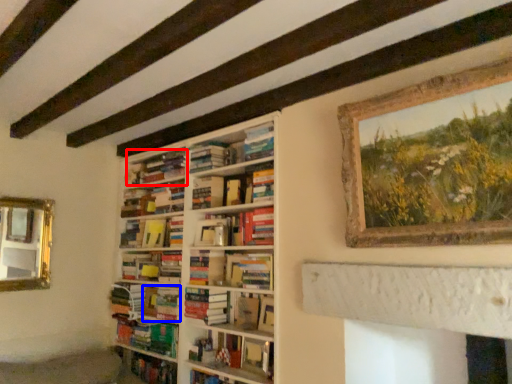
Question: Among these objects, which one is nearest to the camera, book (highlighted by a red box) or book (highlighted by a blue box)?

Choices:
 (A) book
 (B) book

Answer: (A)